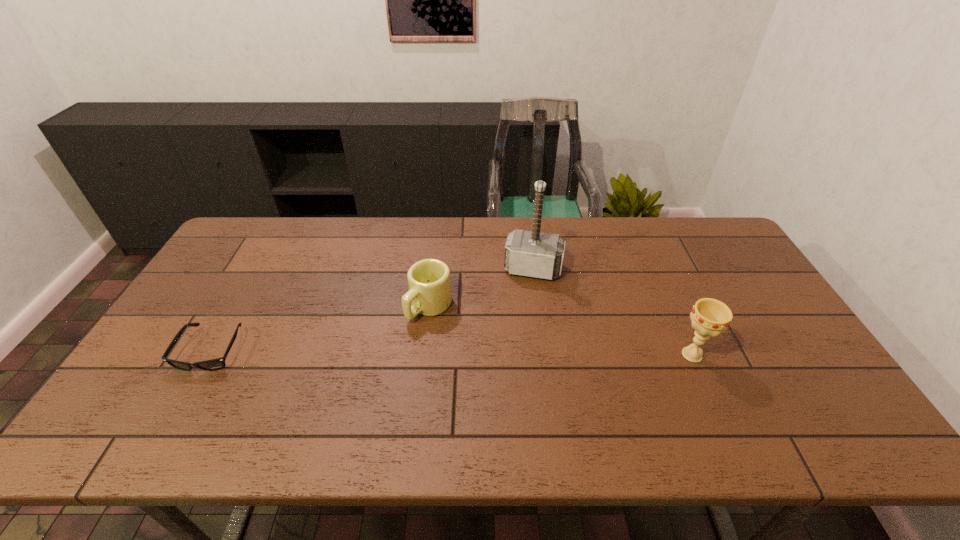
This screenshot has width=960, height=540. Identify the location of free location that satisfies the following two spatial constraints: 1. on the front-facing side of the shortest object; 2. on the left side of the rightmost object. (209, 355).